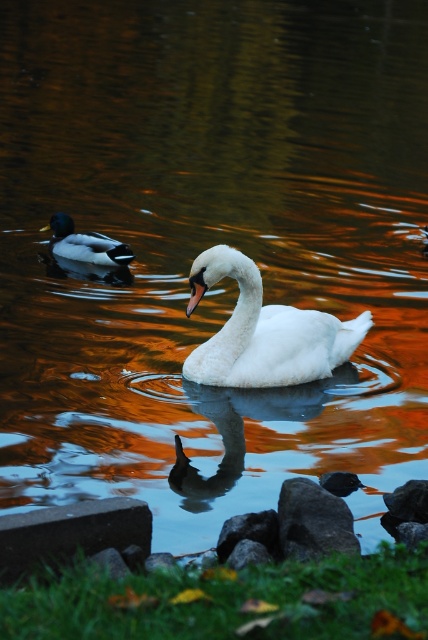
Which is more to the left, gray concrete at lower left or smooth gray rock at lower center?

gray concrete at lower left is more to the left.

Between gray concrete at lower left and smooth gray rock at lower center, which one appears on the right side from the viewer's perspective?

smooth gray rock at lower center

Who is more distant from viewer, (74, 531) or (323, 512)?

The point (323, 512) is more distant.

Where is `gray concrete at lower left`? gray concrete at lower left is located at coordinates (71, 532).

Who is taller, white matte swan at center or green glossy duck at left?

Standing taller between the two is white matte swan at center.

Is white matte swan at center closer to camera compared to green glossy duck at left?

Yes.

Where is `white matte swan at center`? This screenshot has height=640, width=428. white matte swan at center is located at coordinates (264, 332).

At what (x,y) coordinates should I click in order to perform the action: click on white matte swan at center. Please return your answer as a coordinate pair (x, y). Looking at the image, I should click on (264, 332).

Does point (237, 362) come closer to viewer compared to point (5, 548)?

No.

Is point (359, 332) farther from camera compared to point (149, 536)?

Yes, it is behind point (149, 536).

I want to click on white matte swan at center, so click(264, 332).